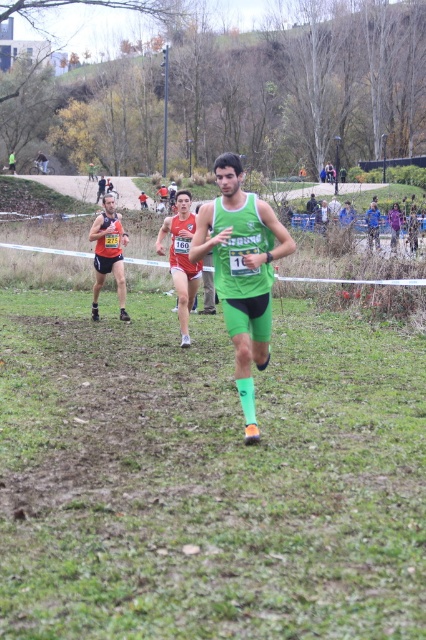
Question: Considering the relative positions of green matte triathlon suit at center and orange mesh tank top at left in the image provided, where is green matte triathlon suit at center located with respect to orange mesh tank top at left?

Choices:
 (A) above
 (B) below

Answer: (B)

Question: Does green matte triathlon suit at center come in front of orange mesh tank top at left?

Choices:
 (A) yes
 (B) no

Answer: (A)

Question: Which object is farther from the camera taking this photo?

Choices:
 (A) green matte triathlon suit at center
 (B) orange mesh tank top at left

Answer: (B)

Question: Can you confirm if green matte triathlon suit at center is positioned to the right of orange mesh tank top at left?

Choices:
 (A) yes
 (B) no

Answer: (A)